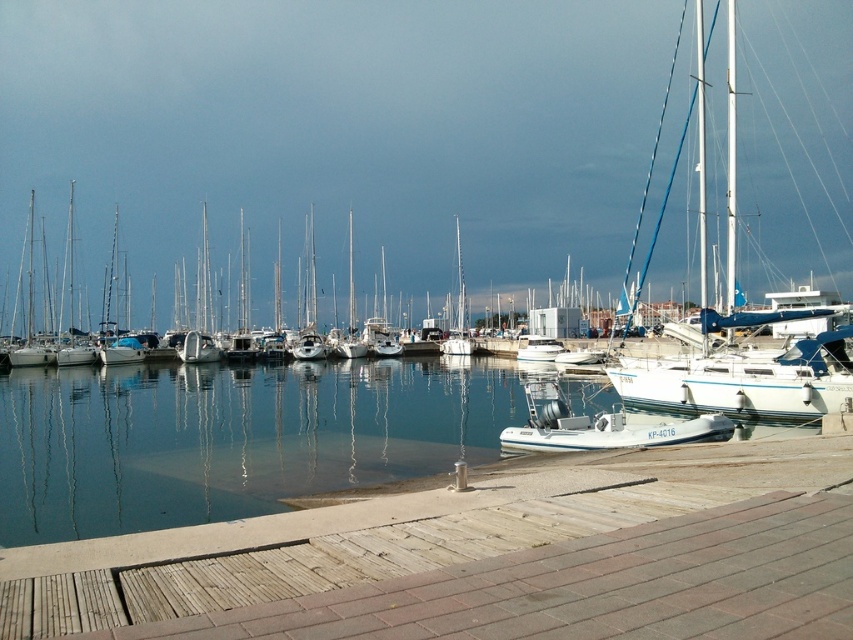
Between clear water at dock center and white glossy boat at center, which one is positioned lower?

clear water at dock center is lower down.

Is clear water at dock center bigger than white glossy boat at center?

Yes.

Who is more forward, [51,532] or [517,349]?

Point [51,532] is more forward.

I want to click on clear water at dock center, so click(x=230, y=438).

Based on the photo, is white glossy sailboat at center below white glossy boat at center?

Incorrect, white glossy sailboat at center is not positioned below white glossy boat at center.

Find the location of a particular element. Image resolution: width=853 pixels, height=640 pixels. white glossy sailboat at center is located at coordinates (747, 381).

How much distance is there between clear water at dock center and white glossy sailboat at center?

They are 40.32 feet apart.

Is clear water at dock center taller than white glossy sailboat at center?

No.

Does point (469, 445) come closer to viewer compared to point (738, 358)?

Yes.

Identify the location of clear water at dock center. (230, 438).